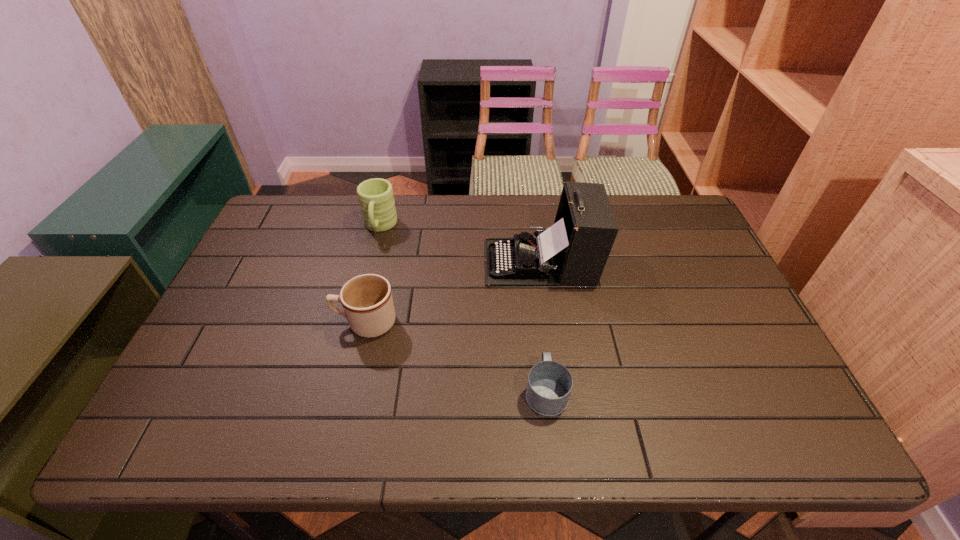
Identify the location of mug that stands as the closest to the farthest mug. This screenshot has width=960, height=540. (367, 302).

Locate an element on the screen. Image resolution: width=960 pixels, height=540 pixels. mug that is the closest one to the rightmost mug is located at coordinates (367, 302).

The height and width of the screenshot is (540, 960). I want to click on vacant region that satisfies the following two spatial constraints: 1. on the side of the farthest mug with the handle; 2. on the side of the third farthest object with the handle, so click(355, 322).

At what (x,y) coordinates should I click in order to perform the action: click on blank space that satisfies the following two spatial constraints: 1. on the side of the second nearest mug with the handle; 2. on the side of the farthest mug with the handle. Please return your answer as a coordinate pair (x, y). Looking at the image, I should click on (388, 227).